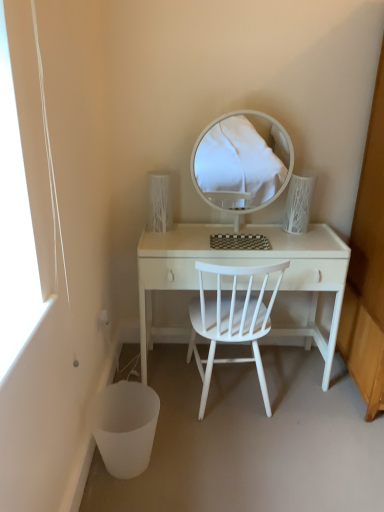
Question: Can you confirm if white matte chair at center is positioned to the left of white glossy mirror at center?

Choices:
 (A) yes
 (B) no

Answer: (A)

Question: Is white matte chair at center closer to camera compared to white glossy mirror at center?

Choices:
 (A) yes
 (B) no

Answer: (A)

Question: From the image's perspective, would you say white matte chair at center is shown under white glossy mirror at center?

Choices:
 (A) no
 (B) yes

Answer: (B)

Question: Can you confirm if white matte chair at center is shorter than white glossy mirror at center?

Choices:
 (A) yes
 (B) no

Answer: (B)

Question: Does white matte chair at center have a greater height compared to white glossy mirror at center?

Choices:
 (A) yes
 (B) no

Answer: (A)

Question: From a real-world perspective, relative to white matte chair at center, is white wood desk at center vertically above or below?

Choices:
 (A) below
 (B) above

Answer: (A)

Question: Choose the correct answer: Is white wood desk at center inside white matte chair at center or outside it?

Choices:
 (A) outside
 (B) inside

Answer: (B)

Question: Considering the positions of white wood desk at center and white matte chair at center in the image, is white wood desk at center wider or thinner than white matte chair at center?

Choices:
 (A) thin
 (B) wide

Answer: (A)

Question: Is point (319, 228) closer or farther from the camera than point (256, 359)?

Choices:
 (A) farther
 (B) closer

Answer: (A)

Question: From their relative heights in the image, would you say white wood desk at center is taller or shorter than white glossy mirror at center?

Choices:
 (A) short
 (B) tall

Answer: (B)

Question: Is point (314, 259) positioned closer to the camera than point (196, 168)?

Choices:
 (A) farther
 (B) closer

Answer: (B)

Question: Looking at their shapes, would you say white wood desk at center is wider or thinner than white glossy mirror at center?

Choices:
 (A) wide
 (B) thin

Answer: (A)

Question: From the image's perspective, is white wood desk at center located above or below white glossy mirror at center?

Choices:
 (A) above
 (B) below

Answer: (B)

Question: Is white matte chair at center taller or shorter than white wood desk at center?

Choices:
 (A) short
 (B) tall

Answer: (B)

Question: From the image's perspective, is white matte chair at center above or below white wood desk at center?

Choices:
 (A) below
 (B) above

Answer: (A)